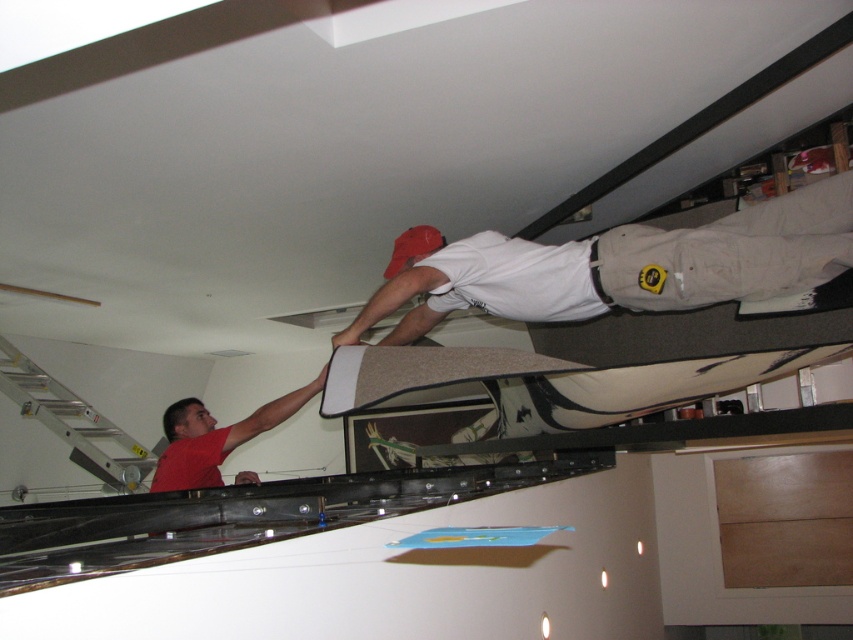
Who is positioned more to the right, white matte shirt at upper center or silver/aluminum ladder at lower left?

From the viewer's perspective, white matte shirt at upper center appears more on the right side.

Does point (798, 273) come farther from viewer compared to point (80, 417)?

No, it is not.

You are a GUI agent. You are given a task and a screenshot of the screen. Output one action in this format:
    pyautogui.click(x=<x>, y=<y>)
    Task: Click on the white matte shirt at upper center
    
    Given the screenshot: What is the action you would take?
    pyautogui.click(x=619, y=266)

Does point (641, 268) come in front of point (235, 438)?

Yes.

Identify the location of white matte shirt at upper center. This screenshot has height=640, width=853. (x=619, y=266).

Describe the element at coordinates (73, 420) in the screenshot. I see `silver/aluminum ladder at lower left` at that location.

Based on the photo, can you confirm if silver/aluminum ladder at lower left is positioned above red matte shirt at lower left?

Incorrect, silver/aluminum ladder at lower left is not positioned above red matte shirt at lower left.

Is point (109, 464) farther from viewer compared to point (206, 458)?

Yes.

The height and width of the screenshot is (640, 853). I want to click on silver/aluminum ladder at lower left, so click(x=73, y=420).